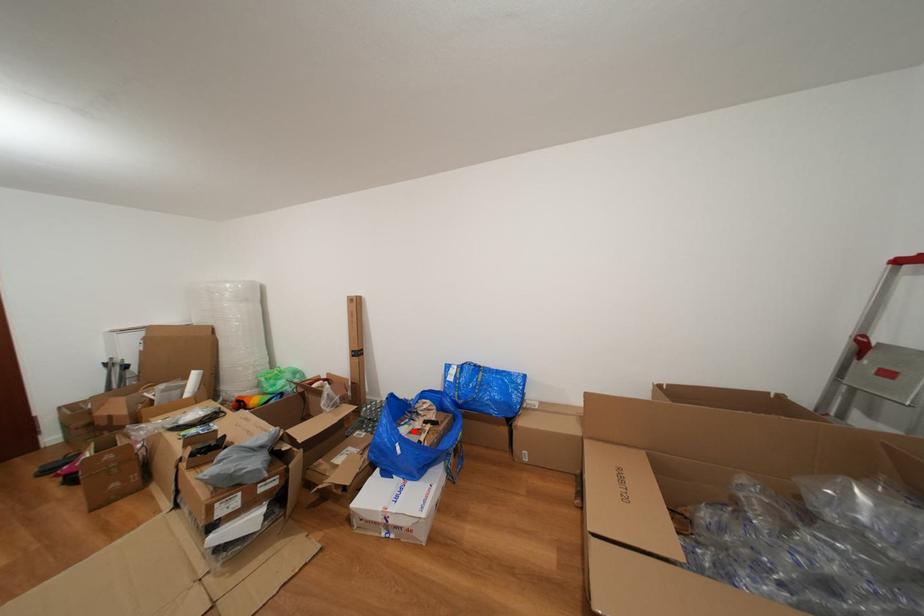
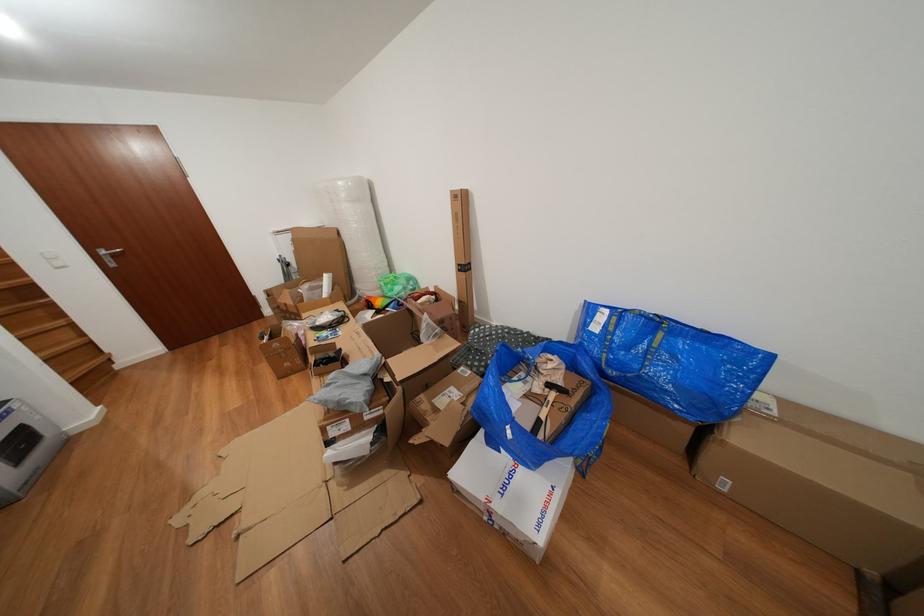
Question: I am providing you with two images of the same scene from different viewpoints. A red point is shown in image1. For the corresponding object point in image2, is it positioned nearer or farther from the camera?

Choices:
 (A) Nearer
 (B) Farther

Answer: (A)